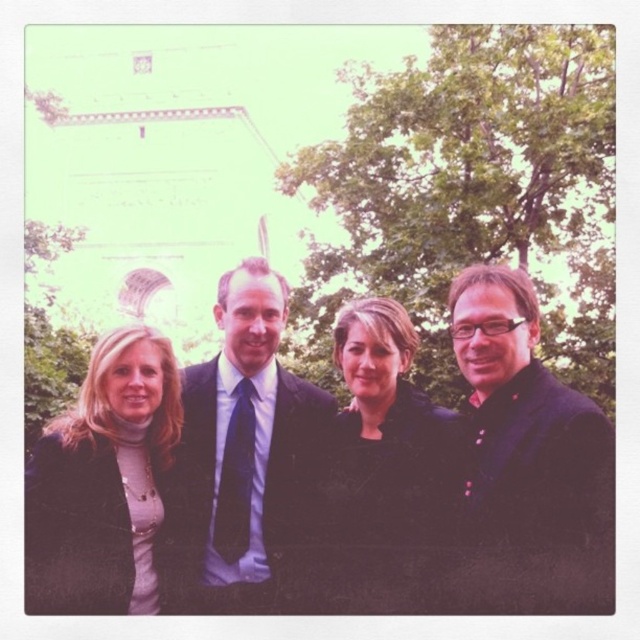
Does point (269, 515) come farther from viewer compared to point (106, 486)?

That is True.

Between point (234, 524) and point (116, 442), which one is positioned in front?

Point (116, 442) is in front.

Is point (316, 412) farther from camera compared to point (92, 557)?

Yes, it is behind point (92, 557).

Where is `matte black suit at center`? matte black suit at center is located at coordinates (237, 452).

Who is more distant from viewer, [83,404] or [604,451]?

→ Point [83,404]

Is black matte suit at center taller than matte black jacket at center?

Yes.

What do you see at coordinates (324, 481) in the screenshot? I see `black matte suit at center` at bounding box center [324, 481].

You are a GUI agent. You are given a task and a screenshot of the screen. Output one action in this format:
    pyautogui.click(x=<x>, y=<y>)
    Task: Click on the black matte suit at center
    Image resolution: width=640 pixels, height=640 pixels.
    Given the screenshot: What is the action you would take?
    pyautogui.click(x=324, y=481)

Looking at this image, which of these two, black matte suit at center or matte black jacket at left, stands taller?

black matte suit at center is taller.

This screenshot has width=640, height=640. Describe the element at coordinates (324, 481) in the screenshot. I see `black matte suit at center` at that location.

Where is `black matte suit at center`? This screenshot has height=640, width=640. black matte suit at center is located at coordinates (324, 481).